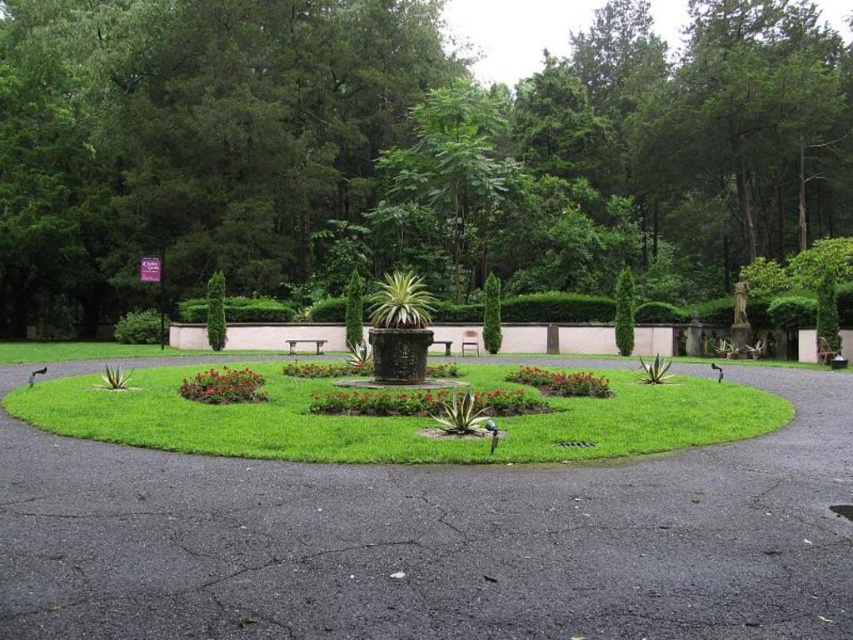
Question: Is vivid red petals at center to the left of wooden bench at center from the viewer's perspective?

Choices:
 (A) no
 (B) yes

Answer: (B)

Question: Which point appears farthest from the camera in this image?

Choices:
 (A) coord(84,516)
 (B) coord(259,392)
 (C) coord(468,333)

Answer: (C)

Question: In this image, where is green leafy tree at center located relative to green grass at center?

Choices:
 (A) above
 (B) below

Answer: (A)

Question: Which of these objects is positioned closest to the green textured bush at center?

Choices:
 (A) green leafy bush at center
 (B) vivid red petals at center

Answer: (B)

Question: Where is green leafy bush at center located in relation to green textured bush at center in the image?

Choices:
 (A) left
 (B) right

Answer: (A)

Question: Which point appears farthest from the camera in this image?

Choices:
 (A) (225, 380)
 (B) (469, 346)
 (C) (833, 205)
 (D) (469, 525)

Answer: (C)